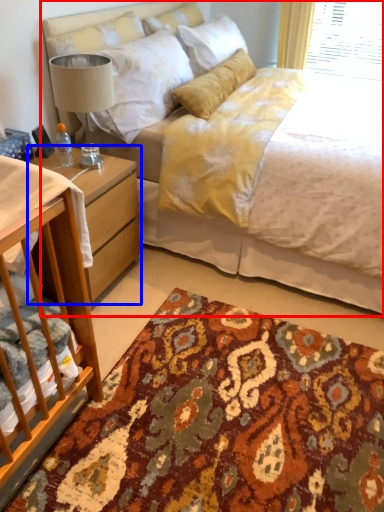
Question: Which of the following is the farthest to the observer, bed (highlighted by a red box) or nightstand (highlighted by a blue box)?

Choices:
 (A) bed
 (B) nightstand

Answer: (B)